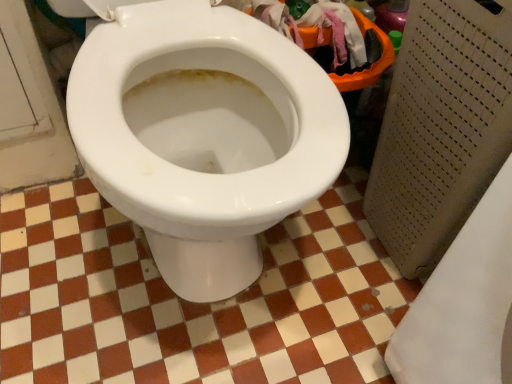
Question: Looking at the image, does white glossy tile at center seem bigger or smaller compared to white glossy toilet at center?

Choices:
 (A) big
 (B) small

Answer: (B)

Question: Is white glossy tile at center in front of or behind white glossy toilet at center in the image?

Choices:
 (A) front
 (B) behind

Answer: (B)

Question: From the image's perspective, is white glossy tile at center located above or below white glossy toilet at center?

Choices:
 (A) below
 (B) above

Answer: (A)

Question: Is point (151, 36) closer or farther from the camera than point (70, 304)?

Choices:
 (A) farther
 (B) closer

Answer: (B)

Question: Looking at their shapes, would you say white glossy toilet at center is wider or thinner than white glossy tile at center?

Choices:
 (A) thin
 (B) wide

Answer: (A)

Question: Is white glossy toilet at center bigger or smaller than white glossy tile at center?

Choices:
 (A) small
 (B) big

Answer: (B)

Question: From the image's perspective, is white glossy toilet at center positioned above or below white glossy tile at center?

Choices:
 (A) below
 (B) above

Answer: (B)